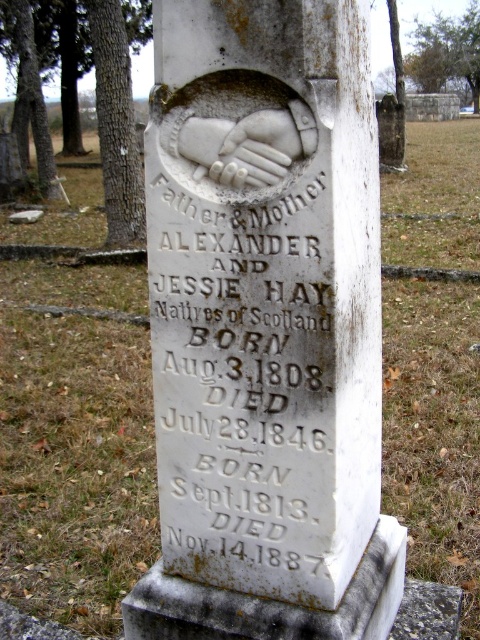
Identify the location of white marble gravestone at center. The height and width of the screenshot is (640, 480). click(x=265, y=328).

Does white marble gravestone at center come in front of white stone inscription at center?

Yes, it is.

Image resolution: width=480 pixels, height=640 pixels. What are the coordinates of `white marble gravestone at center` in the screenshot? It's located at (265, 328).

Which of these two, white stone inscription at center or white marble hand at center, stands shorter?

white marble hand at center

Is white stone inscription at center wider than white marble hand at center?

Indeed, white stone inscription at center has a greater width compared to white marble hand at center.

Measure the distance between white stone inscription at center and camera.

white stone inscription at center is 1.38 meters away from camera.

Identify the location of white stone inscription at center. The width and height of the screenshot is (480, 640). (242, 378).

Is white marble gravestone at center to the right of white marble hand at center from the viewer's perspective?

Yes, white marble gravestone at center is to the right of white marble hand at center.

Is white marble gravestone at center taller than white marble hand at center?

Yes, white marble gravestone at center is taller than white marble hand at center.

Identify the location of white marble gravestone at center. Image resolution: width=480 pixels, height=640 pixels. (265, 328).